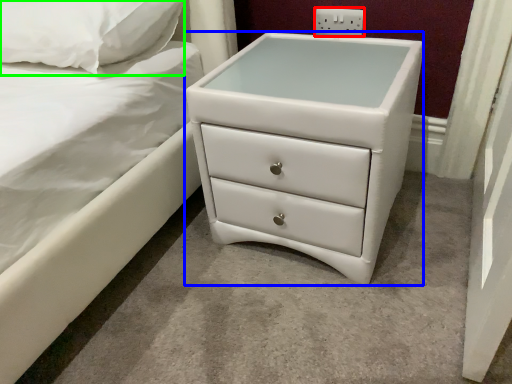
Question: Which object is the farthest from electric outlet (highlighted by a red box)? Choose among these: chest of drawers (highlighted by a blue box) or pillow (highlighted by a green box).

Choices:
 (A) chest of drawers
 (B) pillow

Answer: (B)